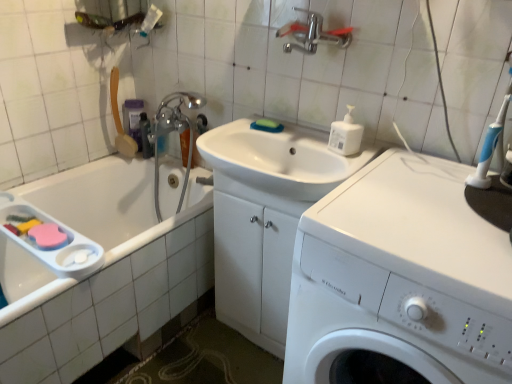
At what (x,y) coordinates should I click in order to perform the action: click on free spot to the left of white plastic bottle at upper right. Please return your answer as a coordinate pair (x, y). The image size is (512, 384). Looking at the image, I should click on (317, 152).